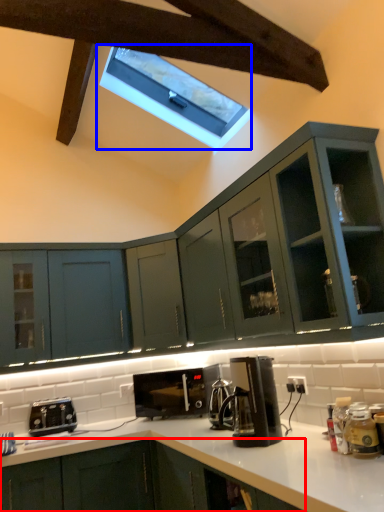
Question: Which object appears farthest to the camera in this image, cabinetry (highlighted by a red box) or window (highlighted by a blue box)?

Choices:
 (A) cabinetry
 (B) window

Answer: (B)